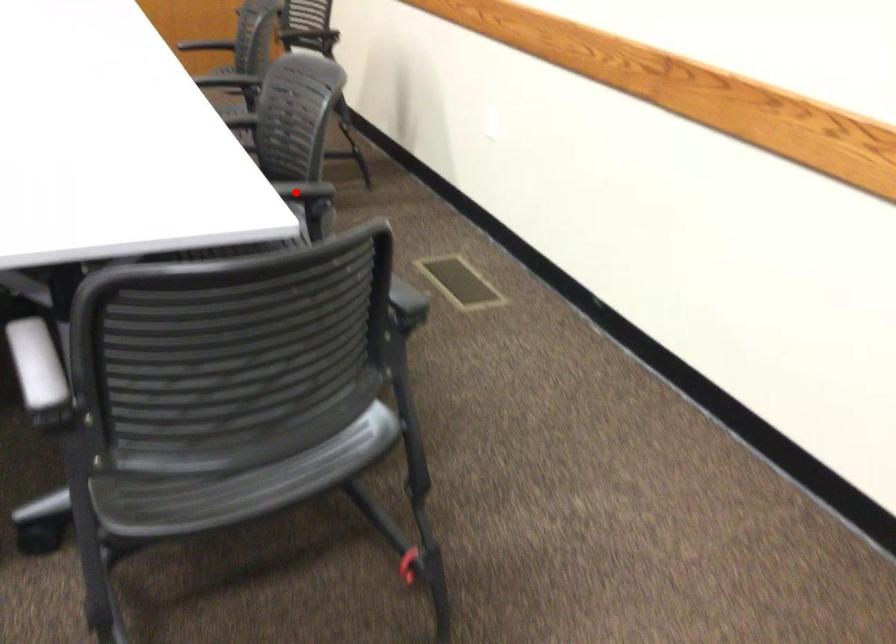
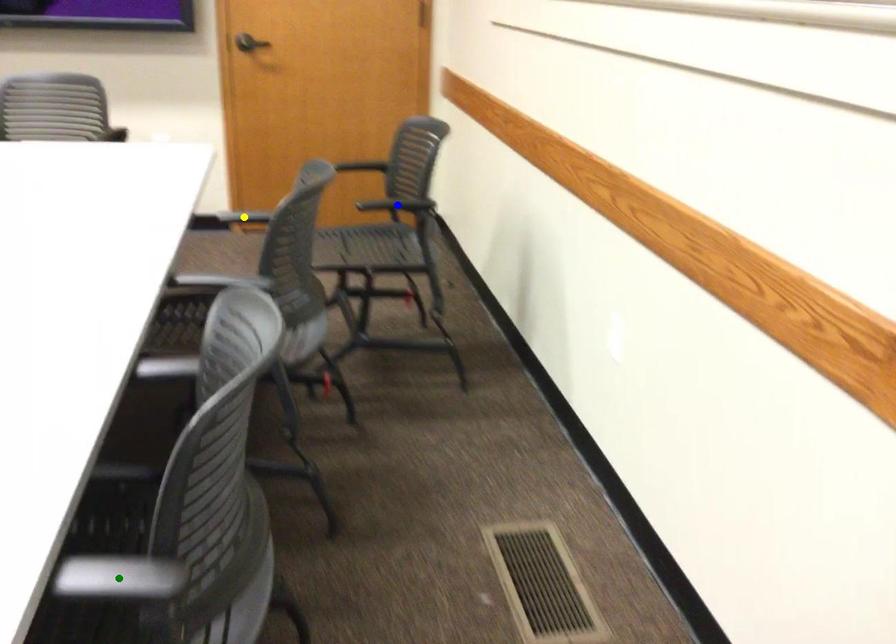
Question: I am providing you with two images of the same scene from different viewpoints. A red point is marked on the first image. You are given multiple points on the second image. Which point in image 2 represents the same 3d spot as the red point in image 1?

Choices:
 (A) green point
 (B) blue point
 (C) yellow point

Answer: (A)